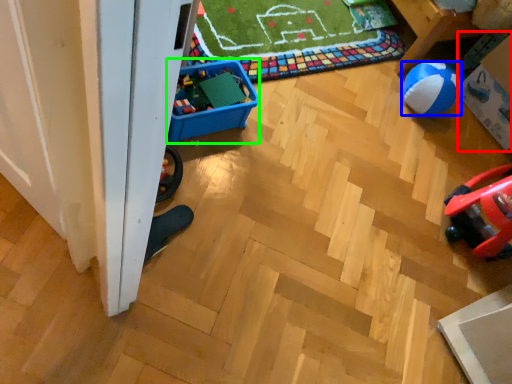
Question: Which object is the closest to the storage box (highlighted by a red box)? Choose among these: ball (highlighted by a blue box) or storage box (highlighted by a green box).

Choices:
 (A) ball
 (B) storage box

Answer: (A)